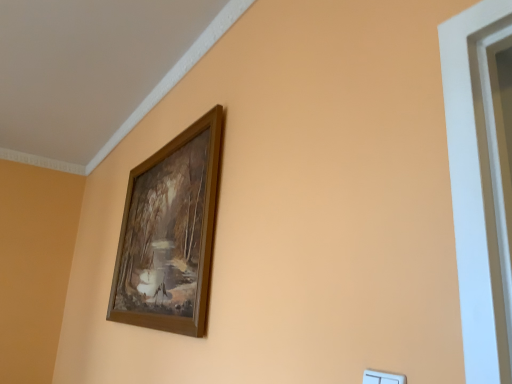
Measure the distance between point (220, 130) and camera.

Point (220, 130) is 4.30 feet from camera.

At what (x,y) coordinates should I click in order to perform the action: click on wooden frame at upper center. Please return your answer as a coordinate pair (x, y). The image size is (512, 384). Looking at the image, I should click on (169, 233).

The width and height of the screenshot is (512, 384). What do you see at coordinates (169, 233) in the screenshot?
I see `wooden frame at upper center` at bounding box center [169, 233].

What is the approximate width of wooden frame at upper center?

The width of wooden frame at upper center is 2.64 inches.

Where is `white plastic light switch at lower right`? The image size is (512, 384). white plastic light switch at lower right is located at coordinates tap(382, 377).

Measure the distance between point (382, 376) and camera.

A distance of 25.94 inches exists between point (382, 376) and camera.

What do you see at coordinates (382, 377) in the screenshot? I see `white plastic light switch at lower right` at bounding box center [382, 377].

Identify the location of wooden frame at upper center. (169, 233).

From the picture: In the image, is white plastic light switch at lower right on the left side or the right side of wooden frame at upper center?

Based on their positions, white plastic light switch at lower right is located to the right of wooden frame at upper center.

Does white plastic light switch at lower right lie in front of wooden frame at upper center?

Yes, white plastic light switch at lower right is closer to the camera.

Which is in front, point (374, 377) or point (187, 231)?

The point (374, 377) is closer.

From the image's perspective, is white plastic light switch at lower right beneath wooden frame at upper center?

Indeed, from the image's perspective, white plastic light switch at lower right is shown beneath wooden frame at upper center.

From a real-world perspective, is white plastic light switch at lower right located beneath wooden frame at upper center?

Yes, from a real-world perspective, white plastic light switch at lower right is beneath wooden frame at upper center.

Considering the relative sizes of white plastic light switch at lower right and wooden frame at upper center in the image provided, is white plastic light switch at lower right thinner than wooden frame at upper center?

Yes.

Can you confirm if white plastic light switch at lower right is shorter than wooden frame at upper center?

Correct, white plastic light switch at lower right is not as tall as wooden frame at upper center.

Based on their sizes in the image, would you say white plastic light switch at lower right is bigger or smaller than wooden frame at upper center?

Considering their sizes, white plastic light switch at lower right takes up less space than wooden frame at upper center.

Is white plastic light switch at lower right completely or partially outside of wooden frame at upper center?

Indeed, white plastic light switch at lower right is completely outside wooden frame at upper center.

Is white plastic light switch at lower right with wooden frame at upper center?

No, white plastic light switch at lower right is not making contact with wooden frame at upper center.

Could you tell me if white plastic light switch at lower right is turned towards wooden frame at upper center?

No, white plastic light switch at lower right is not oriented towards wooden frame at upper center.

What's the angular difference between white plastic light switch at lower right and wooden frame at upper center's facing directions?

The angle between the facing direction of white plastic light switch at lower right and the facing direction of wooden frame at upper center is 0.314 degrees.

Locate an element on the screen. Image resolution: width=512 pixels, height=384 pixels. picture frame to the left of white plastic light switch at lower right is located at coordinates (169, 233).

Considering the relative positions of wooden frame at upper center and white plastic light switch at lower right in the image provided, is wooden frame at upper center to the right of white plastic light switch at lower right from the viewer's perspective?

Incorrect, wooden frame at upper center is not on the right side of white plastic light switch at lower right.

Is the depth of wooden frame at upper center less than that of white plastic light switch at lower right?

No, it is not.

Considering the positions of point (164, 172) and point (371, 376), is point (164, 172) closer or farther from the camera than point (371, 376)?

Point (164, 172) appears to be farther away from the viewer than point (371, 376).

From the image's perspective, relative to white plastic light switch at lower right, is wooden frame at upper center above or below?

A: wooden frame at upper center is situated higher than white plastic light switch at lower right in the image.

From a real-world perspective, who is located higher, wooden frame at upper center or white plastic light switch at lower right?

From a 3D spatial view, wooden frame at upper center is above.

Considering the relative sizes of wooden frame at upper center and white plastic light switch at lower right in the image provided, is wooden frame at upper center thinner than white plastic light switch at lower right?

No, wooden frame at upper center is not thinner than white plastic light switch at lower right.

Is wooden frame at upper center taller than white plastic light switch at lower right?

Yes, wooden frame at upper center is taller than white plastic light switch at lower right.

Can you confirm if wooden frame at upper center is bigger than white plastic light switch at lower right?

Yes.

Is white plastic light switch at lower right located within wooden frame at upper center?

No, white plastic light switch at lower right is located outside of wooden frame at upper center.

Is wooden frame at upper center not close to white plastic light switch at lower right?

No, wooden frame at upper center is in close proximity to white plastic light switch at lower right.

Is wooden frame at upper center positioned with its back to white plastic light switch at lower right?

That's not correct — wooden frame at upper center is not looking away from white plastic light switch at lower right.

Can you tell me how much wooden frame at upper center and white plastic light switch at lower right differ in facing direction?

wooden frame at upper center and white plastic light switch at lower right are facing 0.314 degrees away from each other.

This screenshot has height=384, width=512. Identify the location of picture frame on the left side of white plastic light switch at lower right. pos(169,233).

Locate an element on the screen. light switch located in front of the wooden frame at upper center is located at coordinates (382, 377).

Where is `picture frame positioned vertically above the white plastic light switch at lower right (from a real-world perspective)`? Image resolution: width=512 pixels, height=384 pixels. picture frame positioned vertically above the white plastic light switch at lower right (from a real-world perspective) is located at coordinates (169, 233).